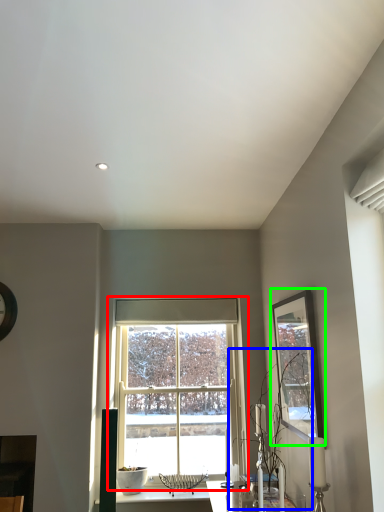
Question: Which object is positioned farthest from window (highlighted by a red box)? Select from plant (highlighted by a blue box) and picture frame (highlighted by a green box).

Choices:
 (A) plant
 (B) picture frame

Answer: (B)